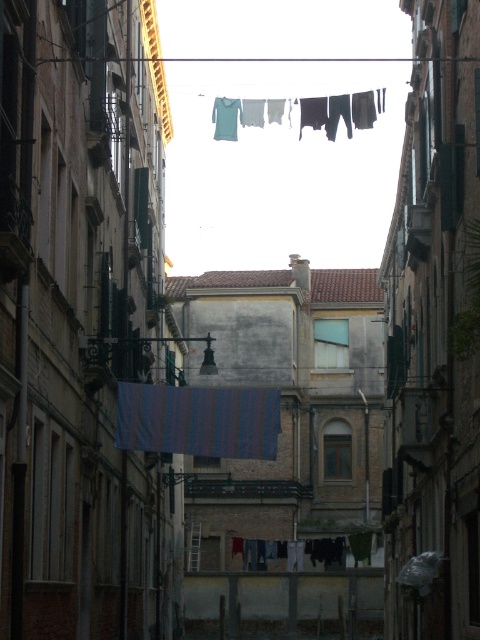
Can you confirm if striped fabric at center is bigger than striped fabric clothesline at center?

No.

Between striped fabric at center and striped fabric clothesline at center, which one appears on the right side from the viewer's perspective?

striped fabric clothesline at center

The image size is (480, 640). What do you see at coordinates (199, 420) in the screenshot? I see `striped fabric at center` at bounding box center [199, 420].

You are a GUI agent. You are given a task and a screenshot of the screen. Output one action in this format:
    pyautogui.click(x=<x>, y=<y>)
    Task: Click on the striped fabric at center
    
    Given the screenshot: What is the action you would take?
    pyautogui.click(x=199, y=420)